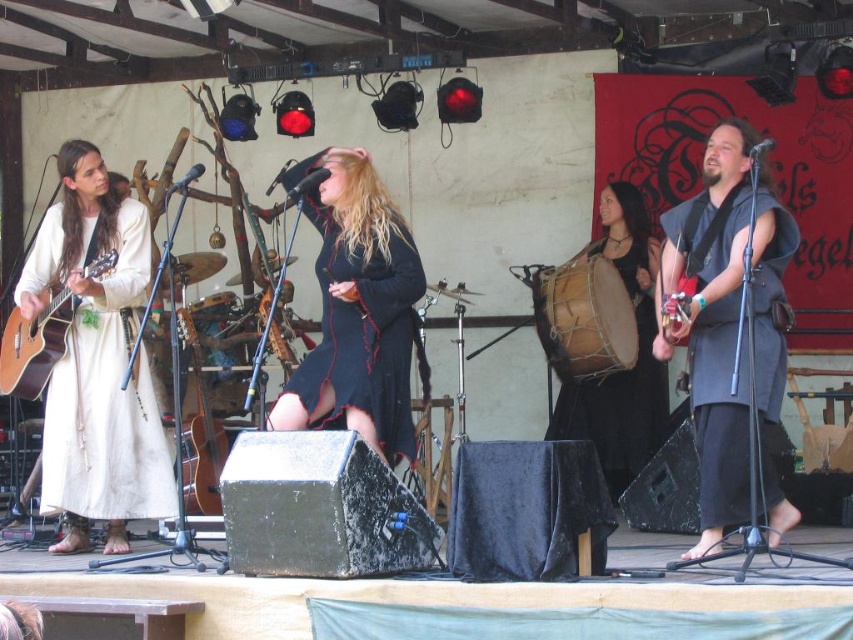
Question: Is matte white gown at left thinner than leather drum at center?

Choices:
 (A) no
 (B) yes

Answer: (A)

Question: Considering the real-world distances, which object is farthest from the leather drum at center?

Choices:
 (A) velvet black dress at center
 (B) matte black drum at center
 (C) matte white gown at left

Answer: (C)

Question: Is matte white gown at left behind matte brown acoustic guitar at left?

Choices:
 (A) no
 (B) yes

Answer: (A)

Question: Estimate the real-world distances between objects in this image. Which object is closer to the matte black vest at center?

Choices:
 (A) velvet black dress at center
 (B) brown wooden guitar at center
 (C) matte white gown at left
 (D) matte brown acoustic guitar at left

Answer: (A)

Question: Based on their relative distances, which object is farther from the brown wooden guitar at center?

Choices:
 (A) matte brown acoustic guitar at left
 (B) velvet black dress at center

Answer: (B)

Question: Observing the image, what is the correct spatial positioning of matte white gown at left in reference to matte brown acoustic guitar at left?

Choices:
 (A) left
 (B) right

Answer: (B)